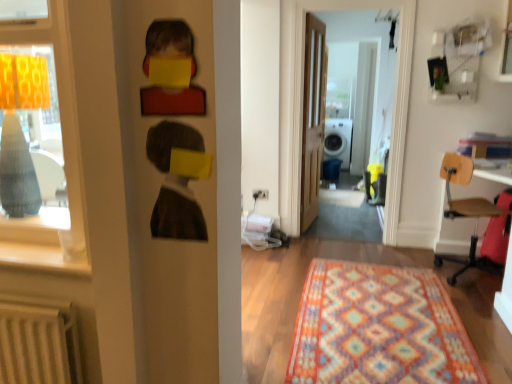
Question: From the image's perspective, does wooden seat chair at right appear lower than matte wood window sill at left?

Choices:
 (A) yes
 (B) no

Answer: (B)

Question: Considering the relative sizes of wooden seat chair at right and matte wood window sill at left in the image provided, is wooden seat chair at right shorter than matte wood window sill at left?

Choices:
 (A) no
 (B) yes

Answer: (A)

Question: Is wooden seat chair at right placed right next to matte wood window sill at left?

Choices:
 (A) yes
 (B) no

Answer: (B)

Question: Is wooden seat chair at right positioned before matte wood window sill at left?

Choices:
 (A) yes
 (B) no

Answer: (B)

Question: Is wooden seat chair at right oriented away from matte wood window sill at left?

Choices:
 (A) yes
 (B) no

Answer: (B)

Question: Considering the positions of matte wood window sill at left and transparent glass door at center in the image, is matte wood window sill at left bigger or smaller than transparent glass door at center?

Choices:
 (A) small
 (B) big

Answer: (A)

Question: Considering their positions, is matte wood window sill at left located in front of or behind transparent glass door at center?

Choices:
 (A) behind
 (B) front

Answer: (B)

Question: Is matte wood window sill at left to the left or to the right of transparent glass door at center in the image?

Choices:
 (A) left
 (B) right

Answer: (A)

Question: Does point (31, 249) appear closer or farther from the camera than point (396, 175)?

Choices:
 (A) closer
 (B) farther

Answer: (A)

Question: Is point (39, 251) closer or farther from the camera than point (317, 165)?

Choices:
 (A) closer
 (B) farther

Answer: (A)

Question: Looking at their shapes, would you say matte wood window sill at left is wider or thinner than wooden door at center?

Choices:
 (A) thin
 (B) wide

Answer: (B)

Question: From a real-world perspective, is matte wood window sill at left physically located above or below wooden door at center?

Choices:
 (A) below
 (B) above

Answer: (A)

Question: From the image's perspective, is matte wood window sill at left positioned above or below wooden door at center?

Choices:
 (A) above
 (B) below

Answer: (B)

Question: From a real-world perspective, is wooden seat chair at right above or below transparent glass door at center?

Choices:
 (A) below
 (B) above

Answer: (A)

Question: Considering the positions of point (470, 256) and point (332, 1), is point (470, 256) closer or farther from the camera than point (332, 1)?

Choices:
 (A) closer
 (B) farther

Answer: (B)